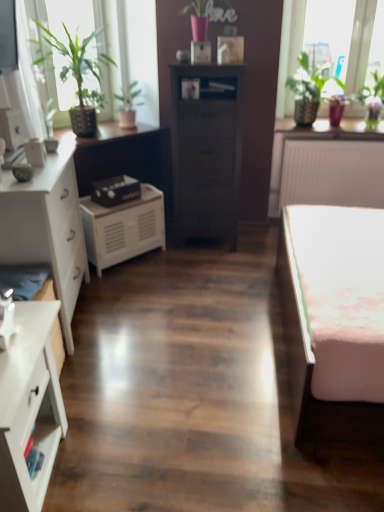
The width and height of the screenshot is (384, 512). What are the coordinates of `vacant space in front of white matte cabinet at center` in the screenshot? It's located at (126, 278).